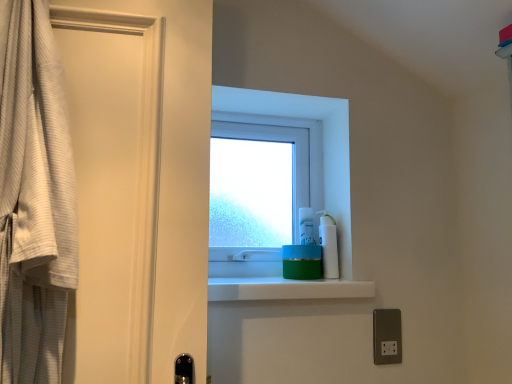
Question: Is white textured robe at left closer to the viewer compared to white plastic pump bottle at upper right?

Choices:
 (A) yes
 (B) no

Answer: (A)

Question: Can you confirm if white textured robe at left is smaller than white plastic pump bottle at upper right?

Choices:
 (A) yes
 (B) no

Answer: (B)

Question: From the image's perspective, is white textured robe at left under white plastic pump bottle at upper right?

Choices:
 (A) yes
 (B) no

Answer: (B)

Question: Is white plastic pump bottle at upper right inside white textured robe at left?

Choices:
 (A) yes
 (B) no

Answer: (B)

Question: Can you confirm if white textured robe at left is thinner than white plastic pump bottle at upper right?

Choices:
 (A) yes
 (B) no

Answer: (B)

Question: Does point (44, 251) appear closer or farther from the camera than point (323, 221)?

Choices:
 (A) closer
 (B) farther

Answer: (A)

Question: Is white textured robe at left in front of or behind white plastic pump bottle at upper right in the image?

Choices:
 (A) front
 (B) behind

Answer: (A)

Question: From a real-world perspective, is white textured robe at left physically located above or below white plastic pump bottle at upper right?

Choices:
 (A) below
 (B) above

Answer: (B)

Question: Is white textured robe at left inside the boundaries of white plastic pump bottle at upper right, or outside?

Choices:
 (A) inside
 (B) outside

Answer: (B)

Question: From the image's perspective, relative to metallic silver outlet at lower right, is white textured robe at left above or below?

Choices:
 (A) above
 (B) below

Answer: (A)

Question: Is point (22, 76) closer or farther from the camera than point (373, 329)?

Choices:
 (A) closer
 (B) farther

Answer: (A)

Question: From a real-world perspective, is white textured robe at left physically located above or below metallic silver outlet at lower right?

Choices:
 (A) above
 (B) below

Answer: (A)

Question: Is white textured robe at left inside the boundaries of metallic silver outlet at lower right, or outside?

Choices:
 (A) inside
 (B) outside

Answer: (B)

Question: Do you think white plastic pump bottle at upper right is within transparent plastic window at center, or outside of it?

Choices:
 (A) outside
 (B) inside

Answer: (A)

Question: From a real-world perspective, is white plastic pump bottle at upper right positioned above or below transparent plastic window at center?

Choices:
 (A) below
 (B) above

Answer: (A)